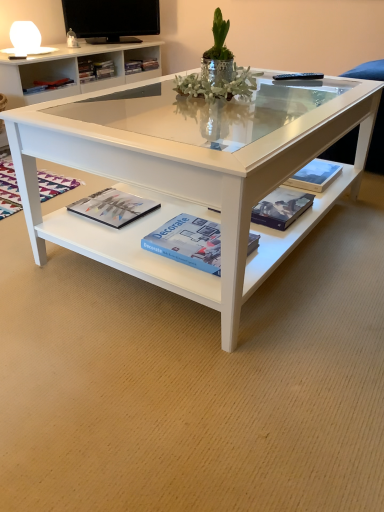
Question: Is blue matte paperback book at center, marked as the second paperback book in a back-to-front arrangement, next to matte black magazine at lower center, the second magazine viewed from the right?

Choices:
 (A) yes
 (B) no

Answer: (B)

Question: Considering the relative sizes of blue matte paperback book at center, positioned as the 1th paperback book in left-to-right order, and matte black magazine at lower center, the second magazine viewed from the right, in the image provided, is blue matte paperback book at center, positioned as the 1th paperback book in left-to-right order, thinner than matte black magazine at lower center, the second magazine viewed from the right,?

Choices:
 (A) no
 (B) yes

Answer: (A)

Question: Would you say matte black magazine at lower center, the second magazine viewed from the right, is part of blue matte paperback book at center, marked as the second paperback book in a back-to-front arrangement,'s contents?

Choices:
 (A) yes
 (B) no

Answer: (B)

Question: Considering the relative sizes of blue matte paperback book at center, marked as the second paperback book in a back-to-front arrangement, and matte black magazine at lower center, the second magazine in the left-to-right sequence, in the image provided, is blue matte paperback book at center, marked as the second paperback book in a back-to-front arrangement, smaller than matte black magazine at lower center, the second magazine in the left-to-right sequence,?

Choices:
 (A) yes
 (B) no

Answer: (B)

Question: Does blue matte paperback book at center, which ranks as the 2th paperback book in right-to-left order, turn towards matte black magazine at lower center, the second magazine viewed from the right?

Choices:
 (A) yes
 (B) no

Answer: (A)

Question: Is blue matte paperback book at center, arranged as the 1th paperback book when viewed from the front, shorter than matte black magazine at lower center, the second magazine viewed from the right?

Choices:
 (A) no
 (B) yes

Answer: (A)

Question: Can you confirm if silver metallic vase at center is wider than matte black book at lower center, which is the 1th magazine from right to left?

Choices:
 (A) yes
 (B) no

Answer: (A)

Question: Would you say silver metallic vase at center contains matte black book at lower center, which is the 1th magazine from right to left?

Choices:
 (A) no
 (B) yes

Answer: (A)

Question: From the image's perspective, does silver metallic vase at center appear higher than matte black book at lower center, which is counted as the third magazine, starting from the left?

Choices:
 (A) no
 (B) yes

Answer: (B)

Question: Can you confirm if silver metallic vase at center is smaller than matte black book at lower center, which is the 1th magazine from right to left?

Choices:
 (A) yes
 (B) no

Answer: (B)

Question: Considering the relative sizes of silver metallic vase at center and matte black book at lower center, which is counted as the third magazine, starting from the left, in the image provided, is silver metallic vase at center bigger than matte black book at lower center, which is counted as the third magazine, starting from the left,?

Choices:
 (A) yes
 (B) no

Answer: (A)

Question: Is silver metallic vase at center outside of matte black book at lower center, which is the 1th magazine from right to left?

Choices:
 (A) no
 (B) yes

Answer: (B)

Question: Considering the relative sizes of matte black magazine at lower left, which is the 1th magazine in left-to-right order, and hardcover book at center, arranged as the first paperback book when viewed from the back, in the image provided, is matte black magazine at lower left, which is the 1th magazine in left-to-right order, wider than hardcover book at center, arranged as the first paperback book when viewed from the back,?

Choices:
 (A) yes
 (B) no

Answer: (A)